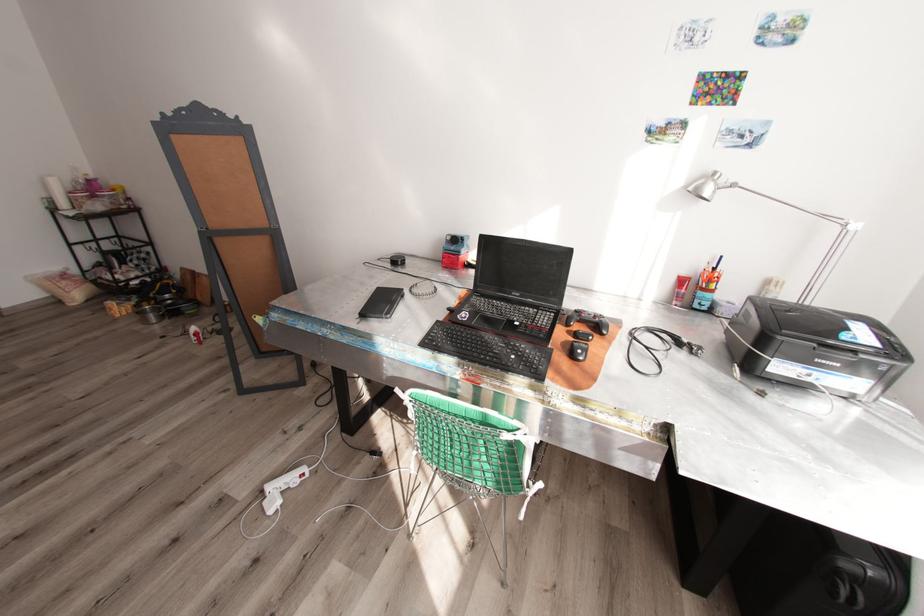
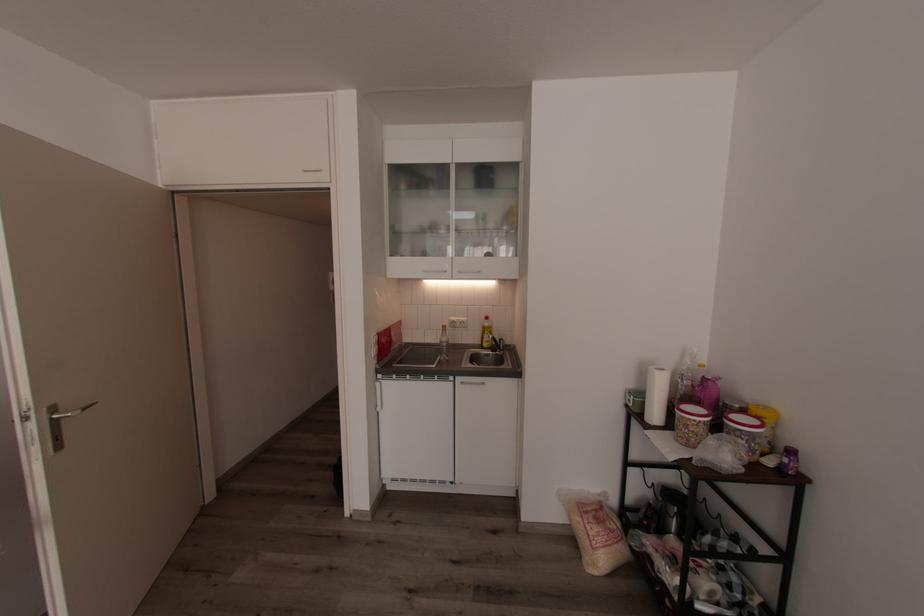
Question: I am providing you with two images of the same scene from different viewpoints. Which of the following objects are not visible in image2?

Choices:
 (A) paper towel roll
 (B) yellow food container
 (C) yellow plastic bottle
 (D) none of these

Answer: (D)